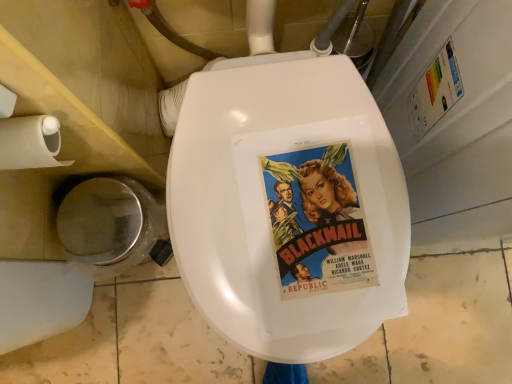
Question: Is vivid paper poster at center in front of or behind shiny metallic trash can at lower left in the image?

Choices:
 (A) behind
 (B) front

Answer: (B)

Question: Considering the positions of vivid paper poster at center and shiny metallic trash can at lower left in the image, is vivid paper poster at center taller or shorter than shiny metallic trash can at lower left?

Choices:
 (A) tall
 (B) short

Answer: (B)

Question: Which object is positioned farthest from the vivid paper poster at center?

Choices:
 (A) shiny metallic trash can at lower left
 (B) beige paper towel at left

Answer: (A)

Question: Which of these objects is positioned farthest from the shiny metallic trash can at lower left?

Choices:
 (A) vivid paper poster at center
 (B) beige paper towel at left

Answer: (A)